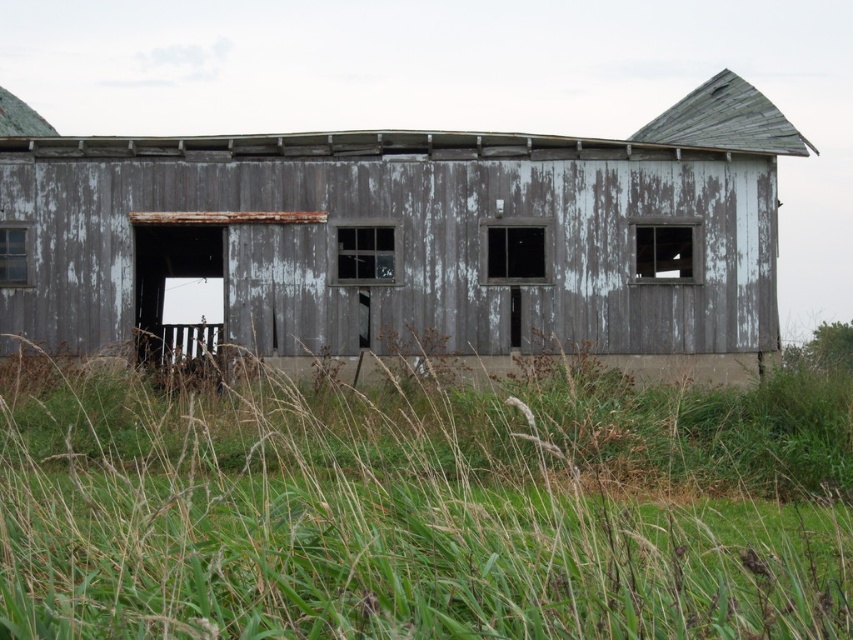
Is point (73, 486) closer to viewer compared to point (267, 268)?

Yes, it is.

Can you confirm if green grass at lower center is positioned to the right of weathered gray wood barn at center?

Indeed, green grass at lower center is positioned on the right side of weathered gray wood barn at center.

This screenshot has width=853, height=640. I want to click on green grass at lower center, so click(x=421, y=506).